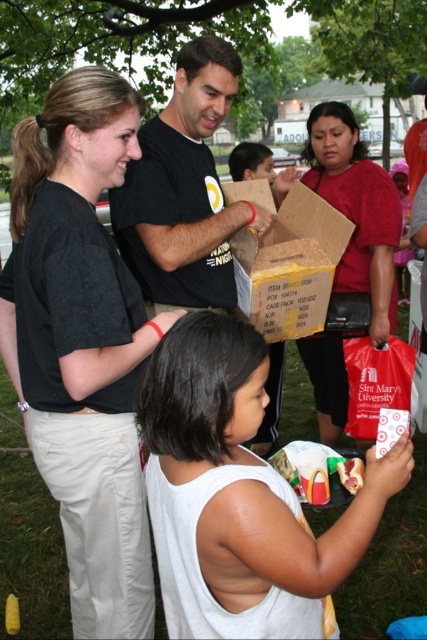
You are organizing a clothing donation drive and need to know if the black matte shirt at upper left can fit into the matte red bag at center based on their sizes. According to the scene description, can it fit?

The black matte shirt at upper left is narrower than the matte red bag at center, so it should fit inside the bag.

You are standing in the park and see two points in the scene. Which point, point (126, 365) or point (348, 109), is closer to you?

Point (126, 365) is closer to the viewer than point (348, 109).